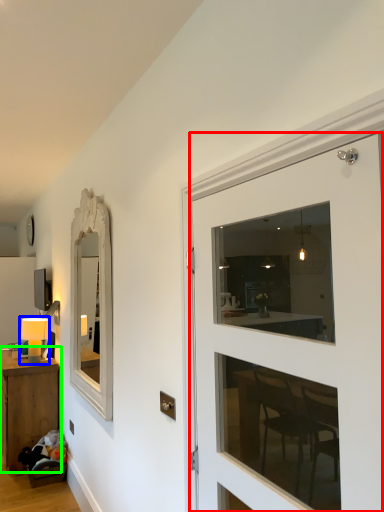
Question: Estimate the real-world distances between objects in this image. Which object is farther from door (highlighted by a red box), table lamp (highlighted by a blue box) or table (highlighted by a green box)?

Choices:
 (A) table lamp
 (B) table

Answer: (A)